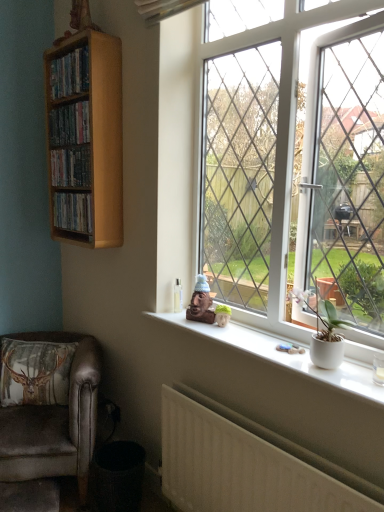
Question: Is wooden shelf at upper left, positioned as the 1th book in top-to-bottom order, turned away from velvety brown pillow at lower left?

Choices:
 (A) no
 (B) yes

Answer: (A)

Question: From the image's perspective, is wooden shelf at upper left, positioned as the 1th book in top-to-bottom order, below velvety brown pillow at lower left?

Choices:
 (A) no
 (B) yes

Answer: (A)

Question: Can we say wooden shelf at upper left, which appears as the third book when ordered from the bottom, lies outside velvety brown pillow at lower left?

Choices:
 (A) no
 (B) yes

Answer: (B)

Question: Is wooden shelf at upper left, positioned as the 1th book in top-to-bottom order, facing towards velvety brown pillow at lower left?

Choices:
 (A) yes
 (B) no

Answer: (B)

Question: Can you confirm if wooden shelf at upper left, positioned as the 1th book in top-to-bottom order, is thinner than velvety brown pillow at lower left?

Choices:
 (A) no
 (B) yes

Answer: (B)

Question: From the image's perspective, is wooden shelf at upper left, which appears as the third book when ordered from the bottom, positioned above or below velvet brown armchair at lower left?

Choices:
 (A) above
 (B) below

Answer: (A)

Question: From a real-world perspective, relative to velvet brown armchair at lower left, is wooden shelf at upper left, positioned as the 1th book in top-to-bottom order, vertically above or below?

Choices:
 (A) above
 (B) below

Answer: (A)

Question: In terms of height, does wooden shelf at upper left, which appears as the third book when ordered from the bottom, look taller or shorter compared to velvet brown armchair at lower left?

Choices:
 (A) short
 (B) tall

Answer: (A)

Question: In terms of size, does wooden shelf at upper left, which appears as the third book when ordered from the bottom, appear bigger or smaller than velvet brown armchair at lower left?

Choices:
 (A) small
 (B) big

Answer: (A)

Question: In the image, is wooden shelf at upper left, the 3th book positioned from the top, on the left side or the right side of white plastic window at center?

Choices:
 (A) left
 (B) right

Answer: (A)

Question: Is wooden shelf at upper left, the 3th book positioned from the top, in front of or behind white plastic window at center in the image?

Choices:
 (A) behind
 (B) front

Answer: (A)

Question: Considering the positions of point (62, 222) and point (243, 189), is point (62, 222) closer or farther from the camera than point (243, 189)?

Choices:
 (A) farther
 (B) closer

Answer: (A)

Question: Considering the positions of wooden shelf at upper left, which ranks as the first book in bottom-to-top order, and white plastic window at center in the image, is wooden shelf at upper left, which ranks as the first book in bottom-to-top order, wider or thinner than white plastic window at center?

Choices:
 (A) thin
 (B) wide

Answer: (B)

Question: In the image, is velvety brown pillow at lower left positioned in front of or behind wooden shelf at left, which ranks as the second book in bottom-to-top order?

Choices:
 (A) front
 (B) behind

Answer: (B)

Question: From a real-world perspective, is velvety brown pillow at lower left physically located above or below wooden shelf at left, which ranks as the second book in bottom-to-top order?

Choices:
 (A) below
 (B) above

Answer: (A)